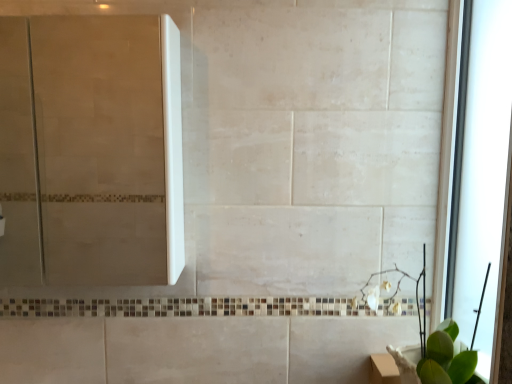
What do you see at coordinates (91, 151) in the screenshot? I see `white glossy screen door at upper left` at bounding box center [91, 151].

What do you see at coordinates (475, 167) in the screenshot? I see `transparent glass window at right` at bounding box center [475, 167].

Where is `white glossy screen door at upper left`? The height and width of the screenshot is (384, 512). white glossy screen door at upper left is located at coordinates (91, 151).

Would you say green leafy plant at lower right is outside transparent glass window at right?

green leafy plant at lower right is positioned outside transparent glass window at right.

From the image's perspective, which one is positioned higher, green leafy plant at lower right or transparent glass window at right?

transparent glass window at right is shown above in the image.

Which of these two, green leafy plant at lower right or transparent glass window at right, is thinner?

transparent glass window at right is thinner.

Is green leafy plant at lower right touching transparent glass window at right?

No, green leafy plant at lower right is not making contact with transparent glass window at right.

Which point is more forward, (477, 238) or (421, 353)?

Positioned in front is point (421, 353).

Is green leafy plant at lower right located within transparent glass window at right?

Definitely not — green leafy plant at lower right is not inside transparent glass window at right.

How much distance is there between transparent glass window at right and green leafy plant at lower right?

transparent glass window at right and green leafy plant at lower right are 9.50 inches apart from each other.

From a real-world perspective, is white glossy screen door at upper left above or below transparent glass window at right?

In terms of real-world spatial position, white glossy screen door at upper left is above transparent glass window at right.

From the image's perspective, is white glossy screen door at upper left beneath transparent glass window at right?

No.

Which of these two, white glossy screen door at upper left or transparent glass window at right, is thinner?

With smaller width is transparent glass window at right.

Does white glossy screen door at upper left turn towards transparent glass window at right?

No, white glossy screen door at upper left is not oriented towards transparent glass window at right.

From a real-world perspective, which object stands above the other?

white glossy screen door at upper left.

Is green leafy plant at lower right far from white glossy screen door at upper left?

Yes, green leafy plant at lower right and white glossy screen door at upper left are quite far apart.

Considering the sizes of objects green leafy plant at lower right and white glossy screen door at upper left in the image provided, who is taller, green leafy plant at lower right or white glossy screen door at upper left?

white glossy screen door at upper left.

Considering the sizes of objects green leafy plant at lower right and white glossy screen door at upper left in the image provided, who is smaller, green leafy plant at lower right or white glossy screen door at upper left?

With smaller size is green leafy plant at lower right.

Considering the positions of objects transparent glass window at right and white glossy screen door at upper left in the image provided, who is behind, transparent glass window at right or white glossy screen door at upper left?

white glossy screen door at upper left is more distant.

In the scene shown: In terms of size, does transparent glass window at right appear bigger or smaller than white glossy screen door at upper left?

Considering their sizes, transparent glass window at right takes up less space than white glossy screen door at upper left.

Is transparent glass window at right thinner than white glossy screen door at upper left?

Indeed, transparent glass window at right has a lesser width compared to white glossy screen door at upper left.

From a real-world perspective, is transparent glass window at right positioned under white glossy screen door at upper left based on gravity?

Indeed, from a real-world perspective, transparent glass window at right is positioned beneath white glossy screen door at upper left.

Looking at this image, which point is more distant from viewer, (119, 143) or (462, 360)?

The point (119, 143) is more distant.

Is white glossy screen door at upper left facing away from green leafy plant at lower right?

No, white glossy screen door at upper left is not facing the opposite direction of green leafy plant at lower right.

Is green leafy plant at lower right inside white glossy screen door at upper left?

Definitely not — green leafy plant at lower right is not inside white glossy screen door at upper left.

From a real-world perspective, does white glossy screen door at upper left stand above green leafy plant at lower right?

Yes, from a real-world perspective, white glossy screen door at upper left is above green leafy plant at lower right.

The width and height of the screenshot is (512, 384). I want to click on plant in front of the transparent glass window at right, so click(x=441, y=346).

The height and width of the screenshot is (384, 512). I want to click on window above the green leafy plant at lower right (from the image's perspective), so click(x=475, y=167).

Which object lies further to the anchor point transparent glass window at right, green leafy plant at lower right or white glossy screen door at upper left?

The object further to transparent glass window at right is white glossy screen door at upper left.

From the picture: When comparing their distances from green leafy plant at lower right, does white glossy screen door at upper left or transparent glass window at right seem closer?

transparent glass window at right is positioned closer to the anchor green leafy plant at lower right.

Looking at the image, which one is located closer to white glossy screen door at upper left, green leafy plant at lower right or transparent glass window at right?

transparent glass window at right is positioned closer to the anchor white glossy screen door at upper left.

From the image, which object appears to be farther from green leafy plant at lower right, transparent glass window at right or white glossy screen door at upper left?

white glossy screen door at upper left is further to green leafy plant at lower right.

Looking at the image, which one is located further to transparent glass window at right, white glossy screen door at upper left or green leafy plant at lower right?

Based on the image, white glossy screen door at upper left appears to be further to transparent glass window at right.

When comparing their distances from white glossy screen door at upper left, does transparent glass window at right or green leafy plant at lower right seem closer?

transparent glass window at right.

In order to click on plant between white glossy screen door at upper left and transparent glass window at right in this screenshot , I will do `click(441, 346)`.